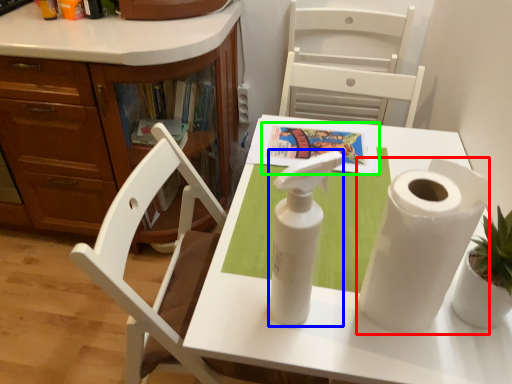
Question: Which object is the farthest from paper towel (highlighted by a red box)? Choose among these: soap dispenser (highlighted by a blue box) or book (highlighted by a green box).

Choices:
 (A) soap dispenser
 (B) book

Answer: (B)